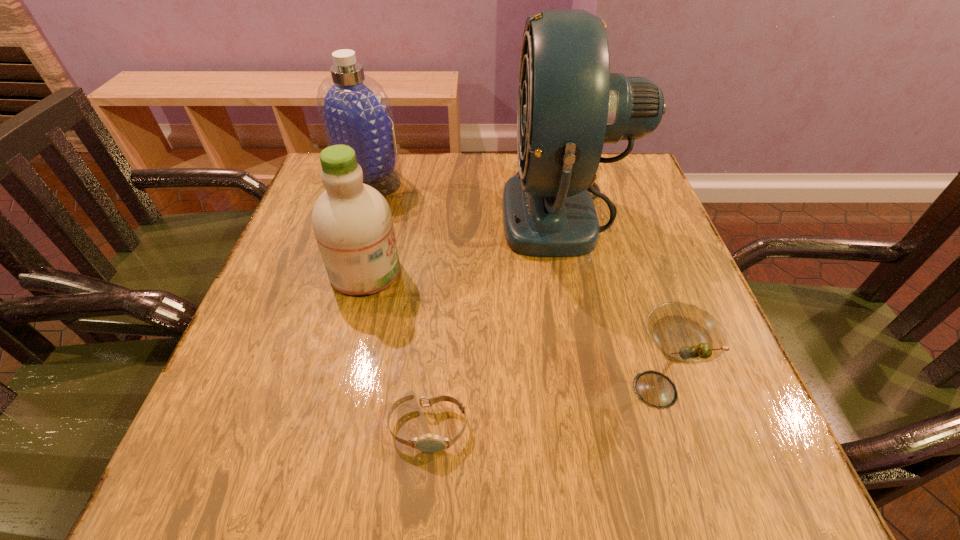
I want to click on vacant space that satisfies the following two spatial constraints: 1. in front of the second shortest object to blow air; 2. on the left side of the fan, so click(605, 389).

Locate an element on the screen. This screenshot has height=540, width=960. blank area in the image that satisfies the following two spatial constraints: 1. in front of the second shortest object to blow air; 2. on the right side of the tallest object is located at coordinates (605, 389).

Where is `vacant space that satisfies the following two spatial constraints: 1. in front of the fan to blow air; 2. on the face of the watch`? The width and height of the screenshot is (960, 540). vacant space that satisfies the following two spatial constraints: 1. in front of the fan to blow air; 2. on the face of the watch is located at coordinates (612, 428).

Locate an element on the screen. The height and width of the screenshot is (540, 960). vacant space that satisfies the following two spatial constraints: 1. in front of the tallest object to blow air; 2. on the right side of the martini is located at coordinates point(605,389).